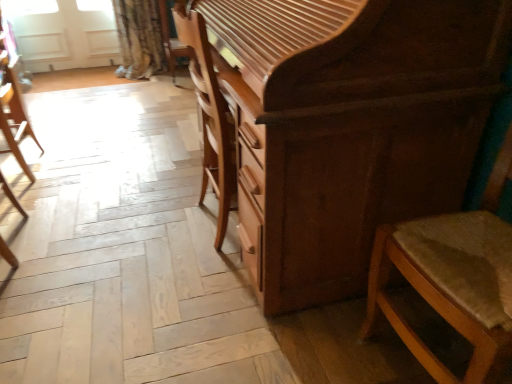
Question: Is wooden textured chair at right, which is counted as the 1th chair, starting from the right, outside of shiny brown chest of drawers at center?

Choices:
 (A) no
 (B) yes

Answer: (B)

Question: Is wooden textured chair at right, which is counted as the 1th chair, starting from the right, looking in the opposite direction of shiny brown chest of drawers at center?

Choices:
 (A) yes
 (B) no

Answer: (B)

Question: From the image's perspective, is wooden textured chair at right, the 2th chair in the left-to-right sequence, beneath shiny brown chest of drawers at center?

Choices:
 (A) yes
 (B) no

Answer: (A)

Question: From the image's perspective, is wooden textured chair at right, the 2th chair in the left-to-right sequence, above shiny brown chest of drawers at center?

Choices:
 (A) yes
 (B) no

Answer: (B)

Question: Can you confirm if wooden textured chair at right, marked as the 2th chair in a back-to-front arrangement, is thinner than shiny brown chest of drawers at center?

Choices:
 (A) no
 (B) yes

Answer: (B)

Question: From the image's perspective, is white matte screen door at upper left above or below wooden chair at left, which is counted as the 1th chair, starting from the left?

Choices:
 (A) below
 (B) above

Answer: (B)

Question: Does point (14, 21) appear closer or farther from the camera than point (8, 86)?

Choices:
 (A) closer
 (B) farther

Answer: (B)

Question: Would you say white matte screen door at upper left is inside or outside wooden chair at left, which is counted as the 1th chair, starting from the left?

Choices:
 (A) inside
 (B) outside

Answer: (B)

Question: Considering the positions of white matte screen door at upper left and wooden chair at left, the 2th chair in the right-to-left sequence, in the image, is white matte screen door at upper left wider or thinner than wooden chair at left, the 2th chair in the right-to-left sequence,?

Choices:
 (A) wide
 (B) thin

Answer: (B)

Question: From a real-world perspective, is shiny brown chest of drawers at center physically located above or below wooden chair at left, placed as the first chair when sorted from back to front?

Choices:
 (A) below
 (B) above

Answer: (B)

Question: Is point (327, 299) positioned closer to the camera than point (7, 147)?

Choices:
 (A) closer
 (B) farther

Answer: (A)

Question: Would you say shiny brown chest of drawers at center is to the left or to the right of wooden chair at left, the 2th chair in the right-to-left sequence, in the picture?

Choices:
 (A) right
 (B) left

Answer: (A)

Question: In terms of width, does shiny brown chest of drawers at center look wider or thinner when compared to wooden chair at left, which appears as the second chair when viewed from the front?

Choices:
 (A) thin
 (B) wide

Answer: (B)

Question: From the image's perspective, is wooden textured chair at right, arranged as the 1th chair when viewed from the front, above or below white matte screen door at upper left?

Choices:
 (A) above
 (B) below

Answer: (B)

Question: Considering the positions of wooden textured chair at right, the 2th chair in the left-to-right sequence, and white matte screen door at upper left in the image, is wooden textured chair at right, the 2th chair in the left-to-right sequence, taller or shorter than white matte screen door at upper left?

Choices:
 (A) tall
 (B) short

Answer: (A)